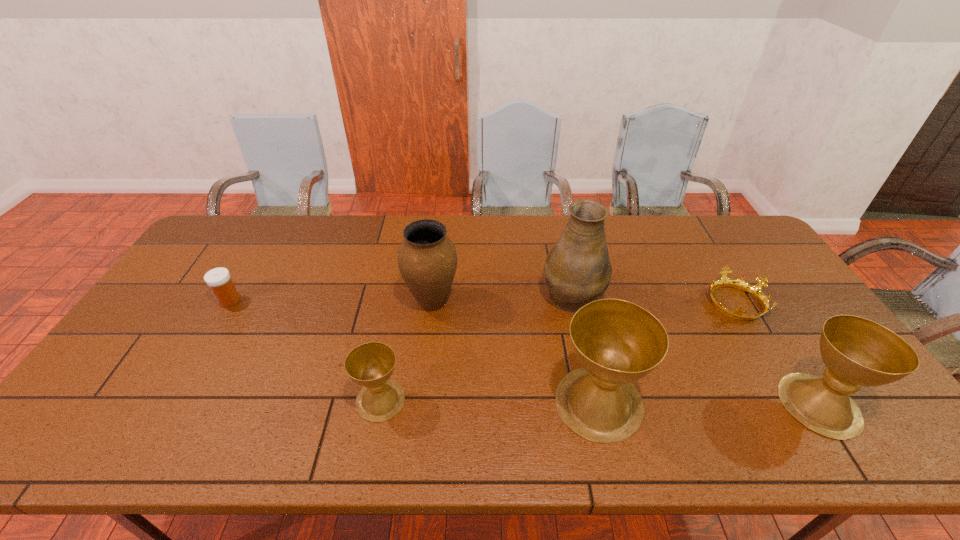
I want to click on vacant space that's between the tallest object and the third shortest object, so click(x=476, y=347).

The image size is (960, 540). Find the location of `free spot between the urn and the third shortest object`. free spot between the urn and the third shortest object is located at coordinates (406, 351).

The width and height of the screenshot is (960, 540). I want to click on empty space that is in between the tallest object and the third shortest object, so click(x=476, y=347).

Locate an element on the screen. This screenshot has width=960, height=540. vacant space that is in between the second chalice from right to left and the third shortest object is located at coordinates (490, 401).

At what (x,y) coordinates should I click in order to perform the action: click on empty space that is in between the medicine and the urn. Please return your answer as a coordinate pair (x, y). Image resolution: width=960 pixels, height=540 pixels. Looking at the image, I should click on (330, 301).

Where is `object that stands as the third closest to the urn`? This screenshot has width=960, height=540. object that stands as the third closest to the urn is located at coordinates (617, 342).

This screenshot has width=960, height=540. I want to click on object that is the third closest to the second chalice from left to right, so click(754, 290).

Identify which chalice is located as the second nearest to the leftmost chalice. Please provide its 2D coordinates. Your answer should be formatted as a tuple, i.e. [(x, y)], where the tuple contains the x and y coordinates of a point satisfying the conditions above.

[(857, 352)]

Identify the location of chalice that is the closest one to the shortest object. Image resolution: width=960 pixels, height=540 pixels. (857, 352).

Find the location of a particular element. This screenshot has height=540, width=960. vacant space that satisfies the following two spatial constraints: 1. on the front side of the second chalice from left to right; 2. on the right side of the urn is located at coordinates (420, 402).